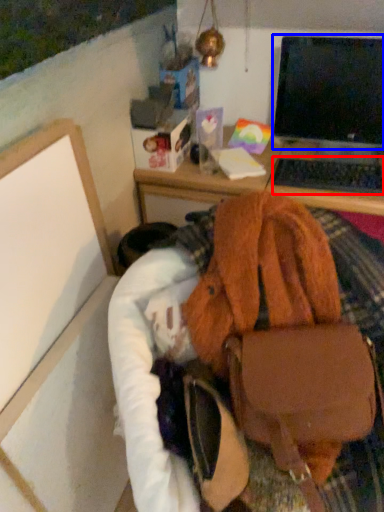
Question: Which object appears farthest to the camera in this image, computer keyboard (highlighted by a red box) or computer monitor (highlighted by a blue box)?

Choices:
 (A) computer keyboard
 (B) computer monitor

Answer: (A)